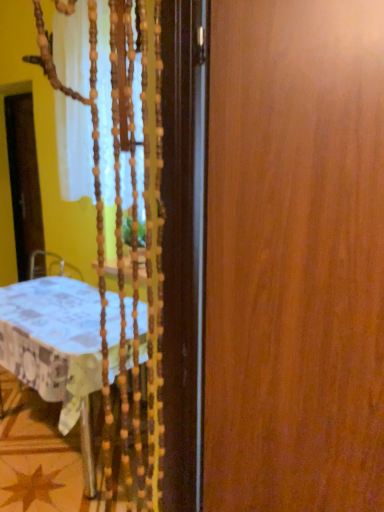
You are a GUI agent. You are given a task and a screenshot of the screen. Output one action in this format:
    pyautogui.click(x=<x>, y=<y>)
    Task: Click on the transparent plastic screen door at left
    The image size is (384, 512).
    Given the screenshot: What is the action you would take?
    pyautogui.click(x=24, y=180)

Is transparent plastic screen door at left facing away from white fabric tablecloth at left?

transparent plastic screen door at left does not have its back to white fabric tablecloth at left.

Which is in front, transparent plastic screen door at left or white fabric tablecloth at left?

Positioned in front is white fabric tablecloth at left.

You are a GUI agent. You are given a task and a screenshot of the screen. Output one action in this format:
    pyautogui.click(x=<x>, y=<y>)
    Task: Click on the furniture below the transparent plastic screen door at left (from the image's perspective)
    
    Given the screenshot: What is the action you would take?
    pyautogui.click(x=53, y=341)

Between transparent plastic screen door at left and white fabric tablecloth at left, which one has smaller size?

Smaller between the two is transparent plastic screen door at left.

Considering the positions of objects wooden door at right and transparent plastic screen door at left in the image provided, who is more to the right, wooden door at right or transparent plastic screen door at left?

From the viewer's perspective, wooden door at right appears more on the right side.

Are wooden door at right and transparent plastic screen door at left making contact?

No, wooden door at right is not with transparent plastic screen door at left.

How different are the orientations of wooden door at right and transparent plastic screen door at left in degrees?

wooden door at right and transparent plastic screen door at left are facing 32 degrees away from each other.

Looking at this image, is wooden door at right facing towards transparent plastic screen door at left?

No, wooden door at right does not turn towards transparent plastic screen door at left.

From the picture: Can you confirm if white fabric tablecloth at left is shorter than wooden door at right?

Yes.

Is white fabric tablecloth at left next to wooden door at right and touching it?

No.

Is white fabric tablecloth at left to the left of wooden door at right from the viewer's perspective?

Indeed, white fabric tablecloth at left is positioned on the left side of wooden door at right.

Is point (97, 367) closer or farther from the camera than point (372, 488)?

Point (97, 367) is farther from the camera than point (372, 488).

How many degrees apart are the facing directions of wooden door at right and white fabric tablecloth at left?

32.2 degrees separate the facing orientations of wooden door at right and white fabric tablecloth at left.

Who is bigger, wooden door at right or white fabric tablecloth at left?

Bigger between the two is white fabric tablecloth at left.

Is wooden door at right taller than white fabric tablecloth at left?

Yes.

Which object is further away from the camera taking this photo, transparent plastic screen door at left or wooden door at right?

transparent plastic screen door at left is more distant.

Is point (29, 158) positioned in front of point (305, 324)?

No, it is not.

From a real-world perspective, is transparent plastic screen door at left physically located above or below wooden door at right?

In terms of real-world spatial position, transparent plastic screen door at left is below wooden door at right.

Would you consider transparent plastic screen door at left to be distant from wooden door at right?

transparent plastic screen door at left is far away from wooden door at right.

Is white fabric tablecloth at left positioned with its back to transparent plastic screen door at left?

No.

Between point (60, 395) and point (29, 150), which one is positioned behind?

Positioned behind is point (29, 150).

Are white fabric tablecloth at left and transparent plastic screen door at left far apart?

Indeed, white fabric tablecloth at left is not near transparent plastic screen door at left.

From the image's perspective, is white fabric tablecloth at left below transparent plastic screen door at left?

Yes, from the image's perspective, white fabric tablecloth at left is below transparent plastic screen door at left.

Identify the location of screen door above the white fabric tablecloth at left (from a real-world perspective). (24, 180).

Identify the location of screen door on the left side of wooden door at right. (24, 180).

Which object lies nearer to the anchor point wooden door at right, transparent plastic screen door at left or white fabric tablecloth at left?

white fabric tablecloth at left lies closer to wooden door at right than the other object.

From the image, which object appears to be farther from white fabric tablecloth at left, wooden door at right or transparent plastic screen door at left?

transparent plastic screen door at left lies further to white fabric tablecloth at left than the other object.

Which object lies nearer to the anchor point transparent plastic screen door at left, wooden door at right or white fabric tablecloth at left?

Based on the image, white fabric tablecloth at left appears to be nearer to transparent plastic screen door at left.

Considering their positions, is transparent plastic screen door at left positioned closer to white fabric tablecloth at left than wooden door at right?

wooden door at right.

Which object lies nearer to the anchor point wooden door at right, white fabric tablecloth at left or transparent plastic screen door at left?

white fabric tablecloth at left is closer to wooden door at right.

Which object lies nearer to the anchor point transparent plastic screen door at left, white fabric tablecloth at left or wooden door at right?

Among the two, white fabric tablecloth at left is located nearer to transparent plastic screen door at left.

At what (x,y) coordinates should I click in order to perform the action: click on furniture between wooden door at right and transparent plastic screen door at left in the front-back direction. Please return your answer as a coordinate pair (x, y). The height and width of the screenshot is (512, 384). Looking at the image, I should click on (53, 341).